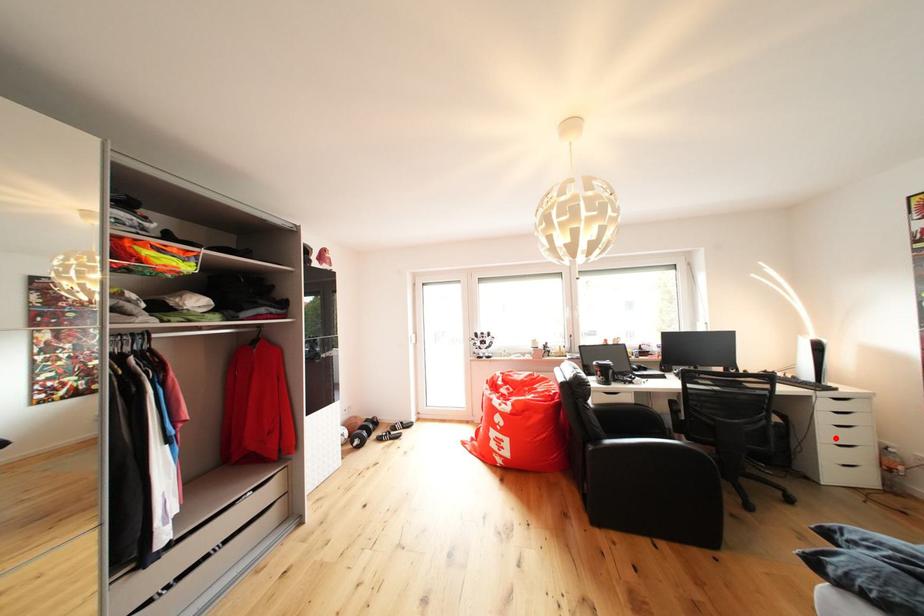
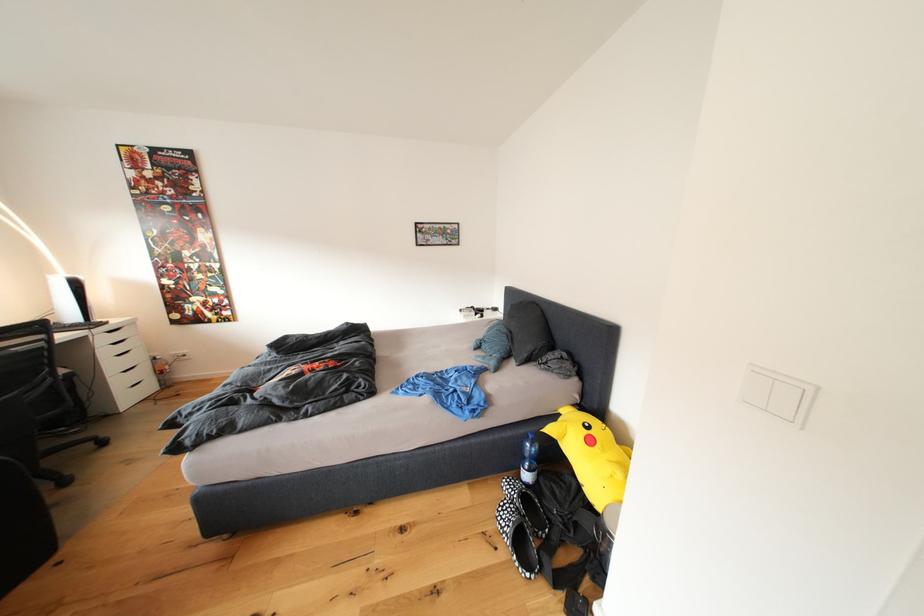
Where in the second image is the point corresponding to the highlighted location from the first image?

(120, 370)